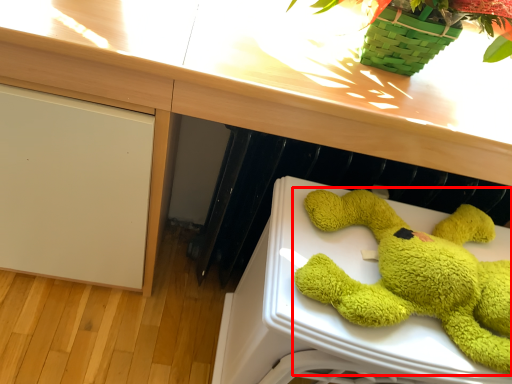
Question: From the image's perspective, what is the correct spatial positioning of toy (annotated by the red box) in reference to counter top?

Choices:
 (A) below
 (B) above

Answer: (A)